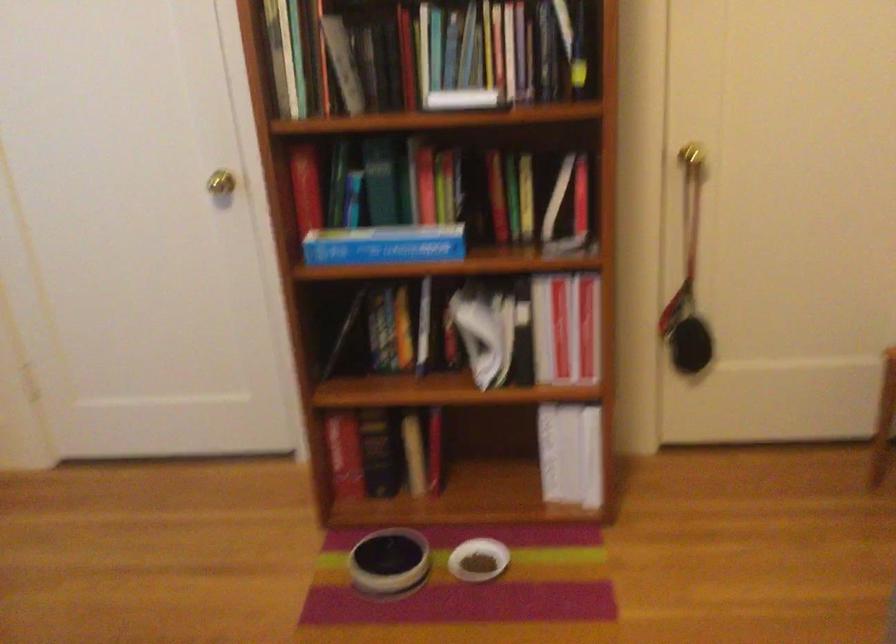
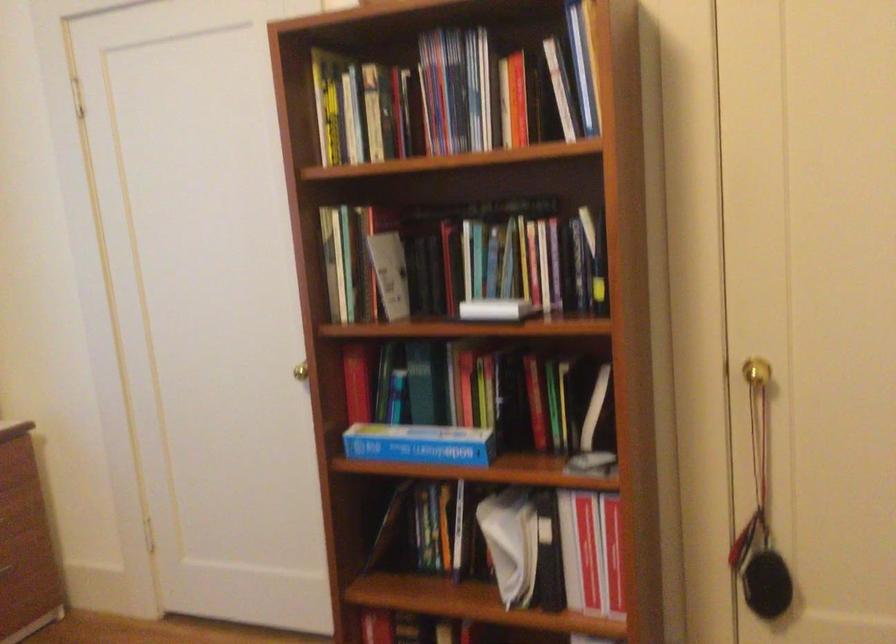
The point at (x=541, y=333) is marked in the first image. Where is the corresponding point in the second image?

(570, 552)